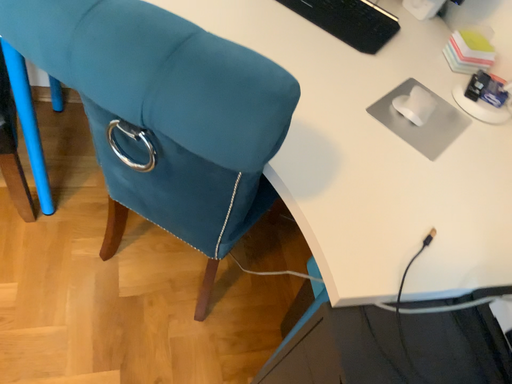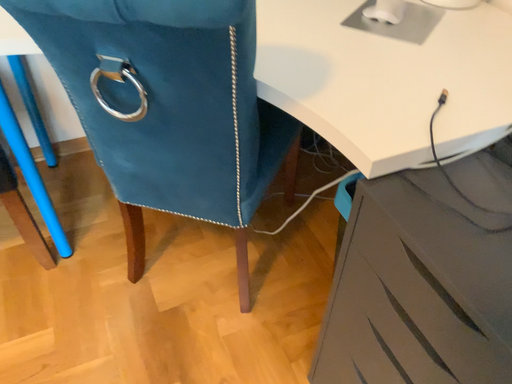
Question: Which way did the camera rotate in the video?

Choices:
 (A) rotated upward
 (B) rotated downward

Answer: (A)